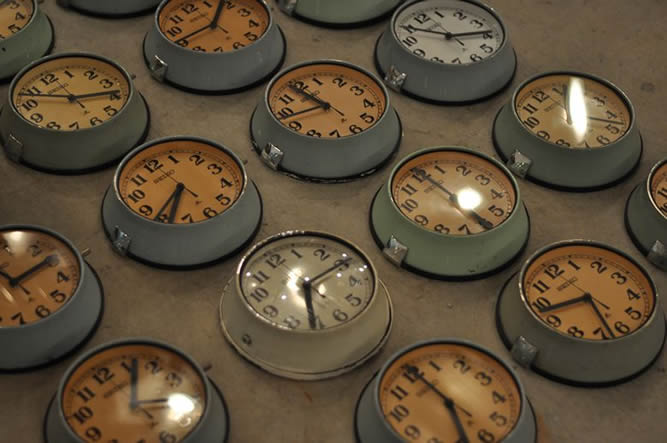
Find the location of a particular element. Image resolution: width=667 pixels, height=443 pixels. clock 4 is located at coordinates (460, 220).